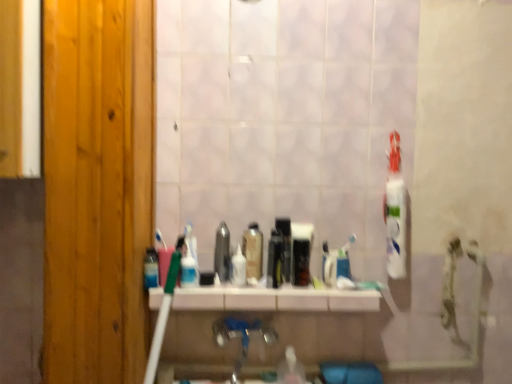
You are a GUI agent. You are given a task and a screenshot of the screen. Output one action in this format:
    pyautogui.click(x=<x>, y=<y>)
    Task: Click on the free location to the right of translucent plastic mouthwash at center, the 2th mouthwash positioned from the left
    Image resolution: width=512 pixels, height=384 pixels.
    Given the screenshot: What is the action you would take?
    pyautogui.click(x=236, y=289)